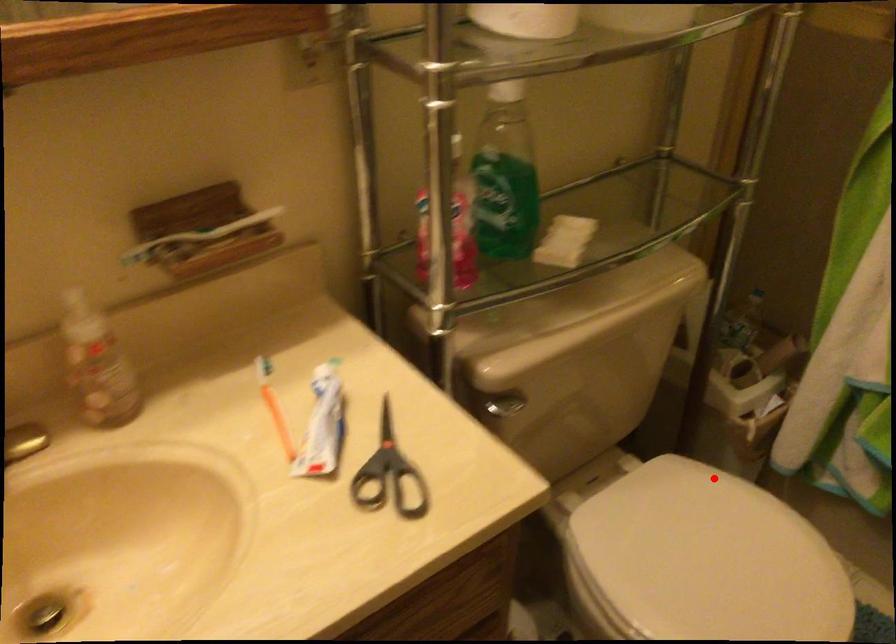
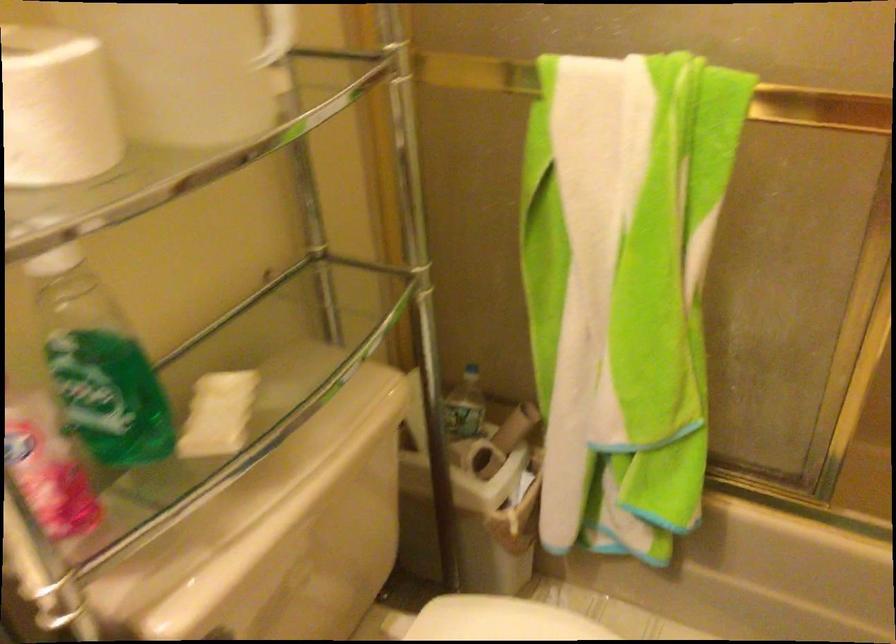
Locate, in the second image, the point that corresponds to the highlighted location in the first image.

(500, 620)